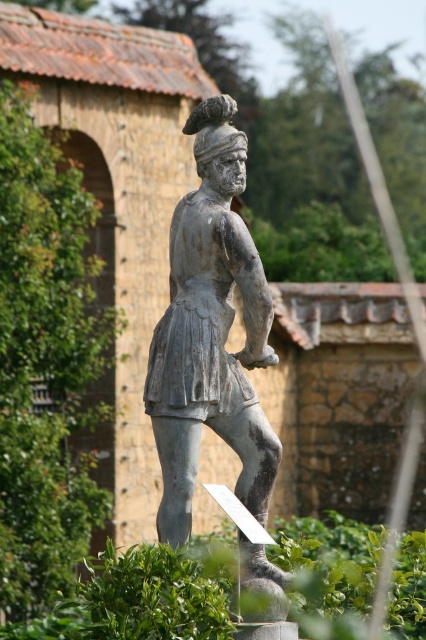
Is matte gray statue at center bigger than gray stone statue at center?

No, matte gray statue at center is not bigger than gray stone statue at center.

This screenshot has width=426, height=640. Describe the element at coordinates (210, 332) in the screenshot. I see `matte gray statue at center` at that location.

Is point (210, 193) positioned after point (403, 593)?

That is False.

Where is `matte gray statue at center`? matte gray statue at center is located at coordinates (210, 332).